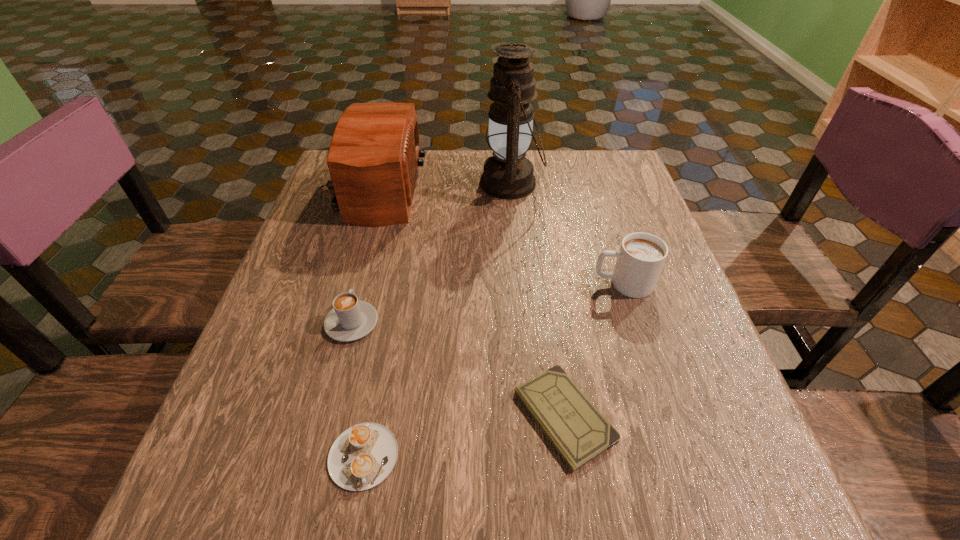
Where is `free space between the shortest object and the tallest object`? free space between the shortest object and the tallest object is located at coordinates click(538, 300).

This screenshot has width=960, height=540. In order to click on unoccupied position between the fourth farthest object and the rightmost object in this screenshot , I will do point(487,303).

At what (x,y) coordinates should I click in order to perform the action: click on the fourth closest object relative to the nearest cappuccino. Please return your answer as a coordinate pair (x, y). Looking at the image, I should click on (373, 160).

Identify which object is the fourth nearest to the tallest object. Please provide its 2D coordinates. Your answer should be formatted as a tuple, i.e. [(x, y)], where the tuple contains the x and y coordinates of a point satisfying the conditions above.

[(579, 432)]

This screenshot has height=540, width=960. I want to click on cappuccino object that ranks as the second closest to the oil lamp, so click(x=350, y=319).

Select which cappuccino appears as the second closest to the radio receiver. Please provide its 2D coordinates. Your answer should be formatted as a tuple, i.e. [(x, y)], where the tuple contains the x and y coordinates of a point satisfying the conditions above.

[(640, 259)]

At what (x,y) coordinates should I click in order to perform the action: click on vacant region that satisfies the following two spatial constraints: 1. on the front-facing side of the second tallest object; 2. on the right side of the shortest object. Please return your answer as a coordinate pair (x, y). Looking at the image, I should click on (305, 416).

Identify the location of free location that satisfies the following two spatial constraints: 1. on the front-facing side of the fifth shortest object; 2. to the right of the fourth tallest object. (333, 323).

At what (x,y) coordinates should I click in order to perform the action: click on vacant space that satisfies the following two spatial constraints: 1. on the front-facing side of the second tallest object; 2. on the left side of the shortest object. Please return your answer as a coordinate pair (x, y). The height and width of the screenshot is (540, 960). Looking at the image, I should click on (305, 416).